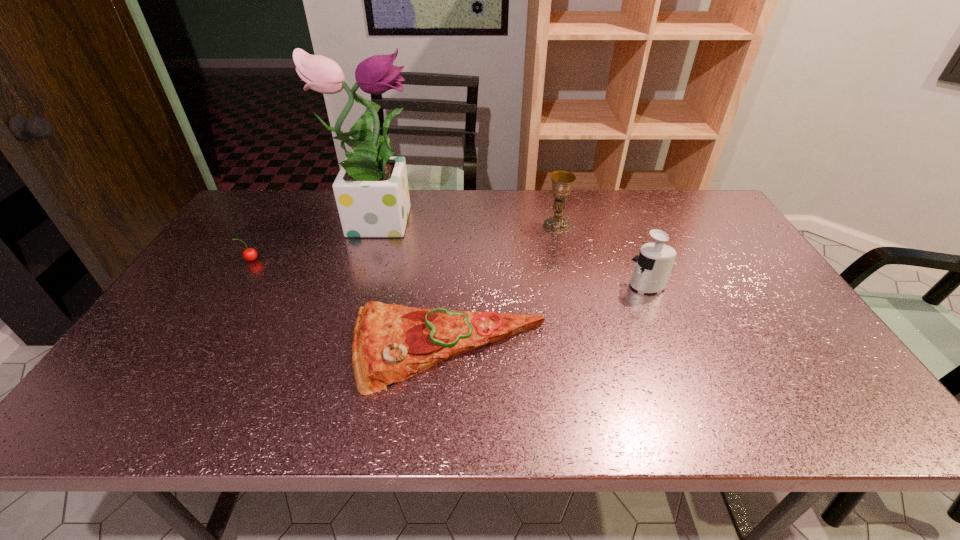
The height and width of the screenshot is (540, 960). In order to click on vacant space at the far left corner in this screenshot , I will do `click(296, 190)`.

This screenshot has height=540, width=960. Identify the location of free region at the near right corner of the desktop. (801, 421).

You are a GUI agent. You are given a task and a screenshot of the screen. Output one action in this format:
    pyautogui.click(x=<x>, y=<y>)
    Task: Click on the empty space that is in between the nearest object and the third farthest object
    The width and height of the screenshot is (960, 540).
    Given the screenshot: What is the action you would take?
    pyautogui.click(x=349, y=305)

Find the location of `free space between the juicer and the nearest object`. free space between the juicer and the nearest object is located at coordinates (548, 318).

Where is `free space between the tallest object and the second nearest object`? This screenshot has height=540, width=960. free space between the tallest object and the second nearest object is located at coordinates (513, 252).

Locate an element on the screen. unoccupied position between the third nearest object and the pizza is located at coordinates (349, 305).

This screenshot has height=540, width=960. I want to click on free point between the tallest object and the fourth farthest object, so click(x=513, y=252).

Identify the location of vacant area that lies between the juicer and the tallest object. This screenshot has width=960, height=540. (513, 252).

Image resolution: width=960 pixels, height=540 pixels. I want to click on free spot between the shortest object and the second nearest object, so click(548, 318).

Locate an element on the screen. Image resolution: width=960 pixels, height=540 pixels. vacant region between the flower arrangement and the third nearest object is located at coordinates (314, 239).